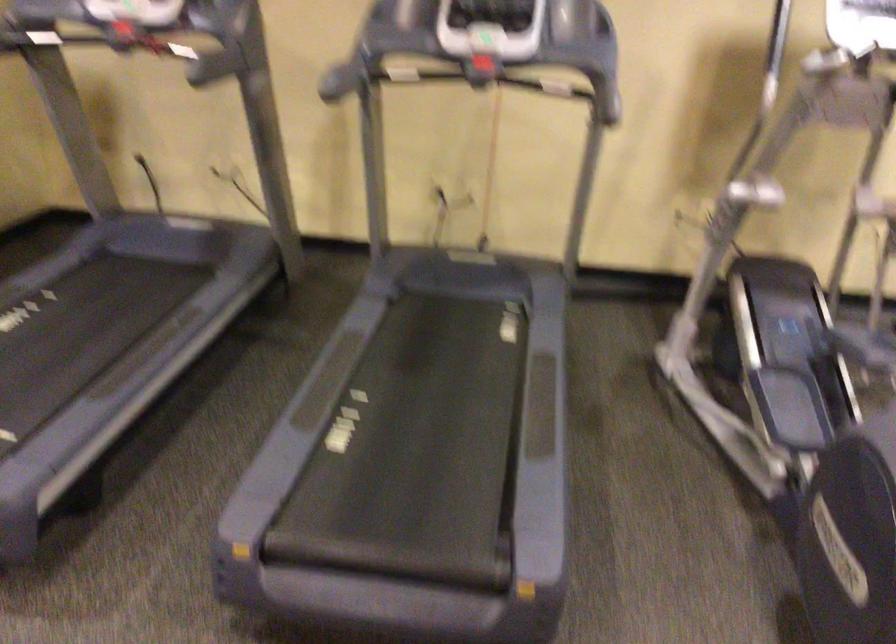
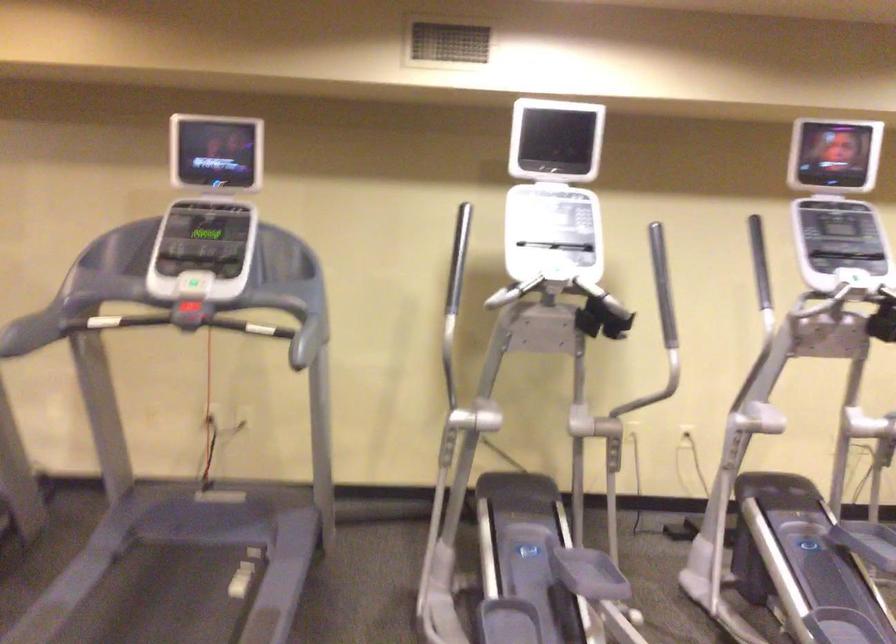
In the second image, find the point that corresponds to (479,69) in the first image.

(187, 321)